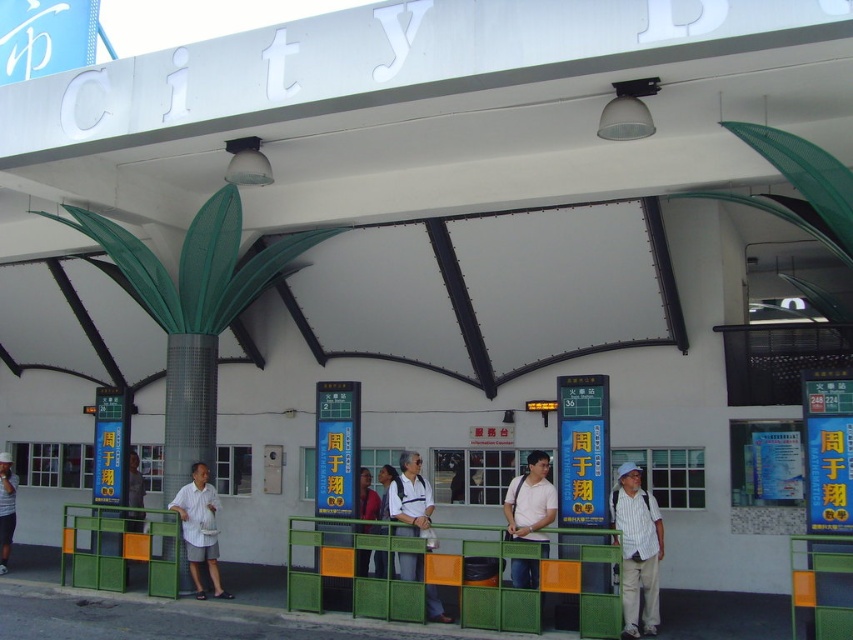
Question: Which point appears farthest from the camera in this image?

Choices:
 (A) (6, 493)
 (B) (525, 572)
 (C) (386, 477)
 (D) (416, 557)

Answer: (A)

Question: Is white striped shirt at center above white fabric shirt at center?

Choices:
 (A) yes
 (B) no

Answer: (B)

Question: Does light gray cotton shirt at center appear over matte pink shirt at center?

Choices:
 (A) yes
 (B) no

Answer: (B)

Question: Which of the following is the farthest from the observer?

Choices:
 (A) white matte shirt at center
 (B) white fabric shirt at center
 (C) white shirt at center
 (D) white cotton shirt at center

Answer: (D)

Question: Which of the following is the closest to the observer?

Choices:
 (A) coord(1,520)
 (B) coord(202,532)

Answer: (B)

Question: Does white matte shirt at center have a greater width compared to matte pink shirt at center?

Choices:
 (A) yes
 (B) no

Answer: (A)